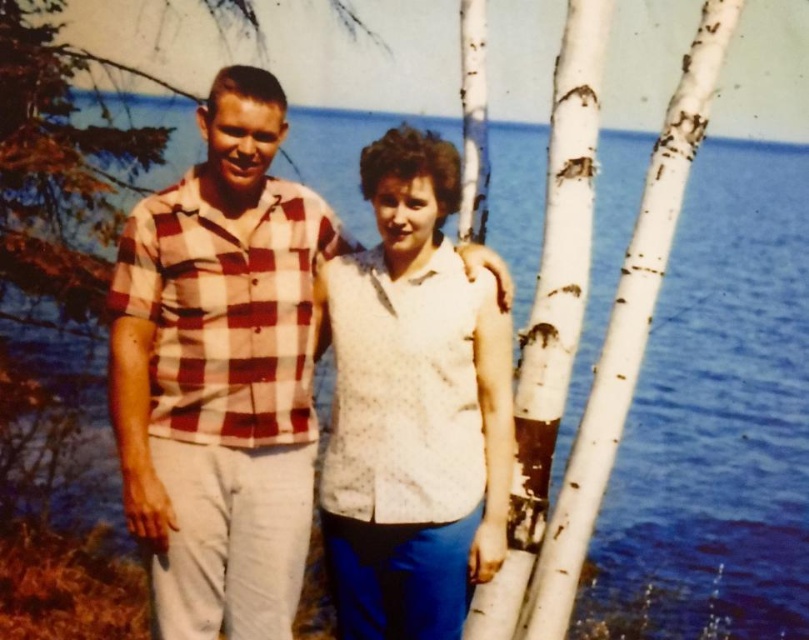
Is checkered fabric shirt at center further to the viewer compared to white dotted shirt at center?

Yes, it is behind white dotted shirt at center.

Is checkered fabric shirt at center thinner than white dotted shirt at center?

In fact, checkered fabric shirt at center might be wider than white dotted shirt at center.

Is point (210, 129) in front of point (392, 346)?

No, (210, 129) is behind (392, 346).

The width and height of the screenshot is (809, 640). Identify the location of checkered fabric shirt at center. (219, 372).